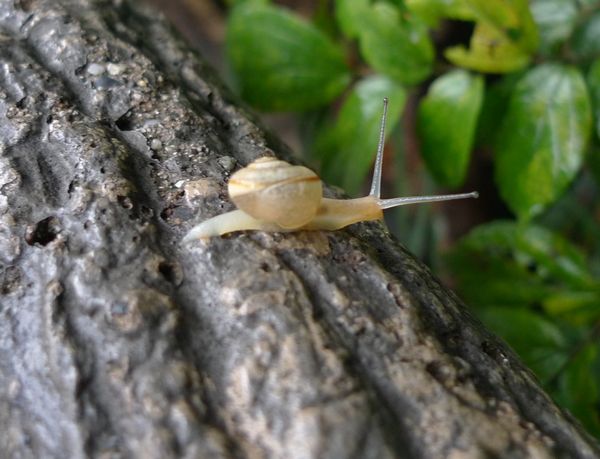
What are the coordinates of `imperfections in the wood` in the screenshot? It's located at [x=126, y=125], [x=47, y=235], [x=178, y=211], [x=438, y=365].